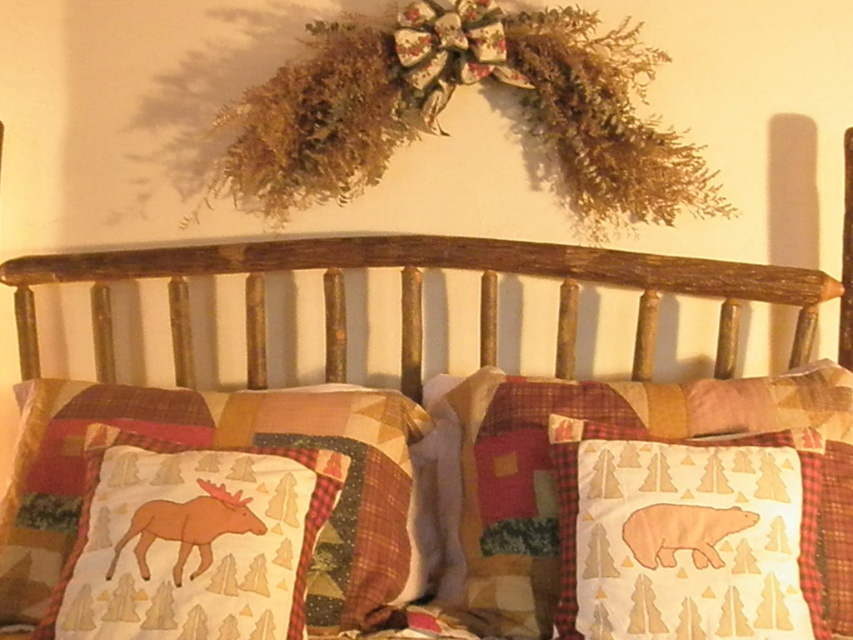
Is point (35, 384) farther from viewer compared to point (454, 570)?

Yes, point (35, 384) is farther from viewer.

Is patchwork fabric pillow with moose design at center to the left of white cotton bear at center from the viewer's perspective?

Yes, patchwork fabric pillow with moose design at center is to the left of white cotton bear at center.

Is point (268, 442) closer to viewer compared to point (631, 388)?

Yes.

At what (x,y) coordinates should I click in order to perform the action: click on patchwork fabric pillow with moose design at center. Please return your answer as a coordinate pair (x, y). This screenshot has width=853, height=640. Looking at the image, I should click on (221, 448).

Does rustic wood headboard at center lie behind white cotton bear at center?

Yes, rustic wood headboard at center is further from the viewer.

Consider the image. Who is taller, rustic wood headboard at center or white cotton bear at center?

white cotton bear at center

Who is more distant from viewer, [341,348] or [544,472]?

The point [341,348] is more distant.

I want to click on rustic wood headboard at center, so click(421, 294).

Does rustic wood headboard at center appear over brown fabric moose at lower left?

Indeed, rustic wood headboard at center is positioned over brown fabric moose at lower left.

Describe the element at coordinates (421, 294) in the screenshot. I see `rustic wood headboard at center` at that location.

Identify the location of rustic wood headboard at center. (421, 294).